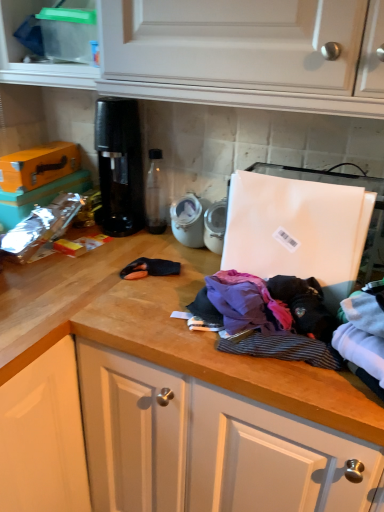
Question: Is clear plastic container at upper left aimed at purple fabric at center, which is the first clothing in left-to-right order?

Choices:
 (A) yes
 (B) no

Answer: (B)

Question: Considering the relative sizes of clear plastic container at upper left and purple fabric at center, which is the fourth clothing in right-to-left order, in the image provided, is clear plastic container at upper left taller than purple fabric at center, which is the fourth clothing in right-to-left order,?

Choices:
 (A) yes
 (B) no

Answer: (A)

Question: Does clear plastic container at upper left lie behind purple fabric at center, which is the fourth clothing in right-to-left order?

Choices:
 (A) yes
 (B) no

Answer: (A)

Question: Can you confirm if clear plastic container at upper left is wider than purple fabric at center, which is the first clothing in left-to-right order?

Choices:
 (A) yes
 (B) no

Answer: (A)

Question: Is clear plastic container at upper left smaller than purple fabric at center, which is the first clothing in left-to-right order?

Choices:
 (A) no
 (B) yes

Answer: (A)

Question: From a real-world perspective, relative to purple fabric at center, which is the fourth clothing in right-to-left order, is black plastic coffee machine at center vertically above or below?

Choices:
 (A) above
 (B) below

Answer: (A)

Question: From the image's perspective, is black plastic coffee machine at center positioned above or below purple fabric at center, which is the fourth clothing in right-to-left order?

Choices:
 (A) below
 (B) above

Answer: (B)

Question: Is black plastic coffee machine at center to the left or to the right of purple fabric at center, which is the fourth clothing in right-to-left order, in the image?

Choices:
 (A) right
 (B) left

Answer: (B)

Question: In terms of height, does black plastic coffee machine at center look taller or shorter compared to purple fabric at center, which is the first clothing in left-to-right order?

Choices:
 (A) tall
 (B) short

Answer: (A)

Question: In terms of width, does black plastic coffee machine at center look wider or thinner when compared to clear plastic container at upper left?

Choices:
 (A) thin
 (B) wide

Answer: (A)

Question: From the image's perspective, is black plastic coffee machine at center positioned above or below clear plastic container at upper left?

Choices:
 (A) above
 (B) below

Answer: (B)

Question: In terms of height, does black plastic coffee machine at center look taller or shorter compared to clear plastic container at upper left?

Choices:
 (A) tall
 (B) short

Answer: (A)

Question: Is black plastic coffee machine at center in front of or behind clear plastic container at upper left in the image?

Choices:
 (A) behind
 (B) front

Answer: (A)

Question: In terms of width, does purple cotton shirt at center, arranged as the third clothing when viewed from the left, look wider or thinner when compared to striped cotton shirt at center, which ranks as the second clothing in left-to-right order?

Choices:
 (A) wide
 (B) thin

Answer: (B)

Question: Considering their positions, is purple cotton shirt at center, arranged as the third clothing when viewed from the left, located in front of or behind striped cotton shirt at center, which ranks as the second clothing in left-to-right order?

Choices:
 (A) front
 (B) behind

Answer: (B)